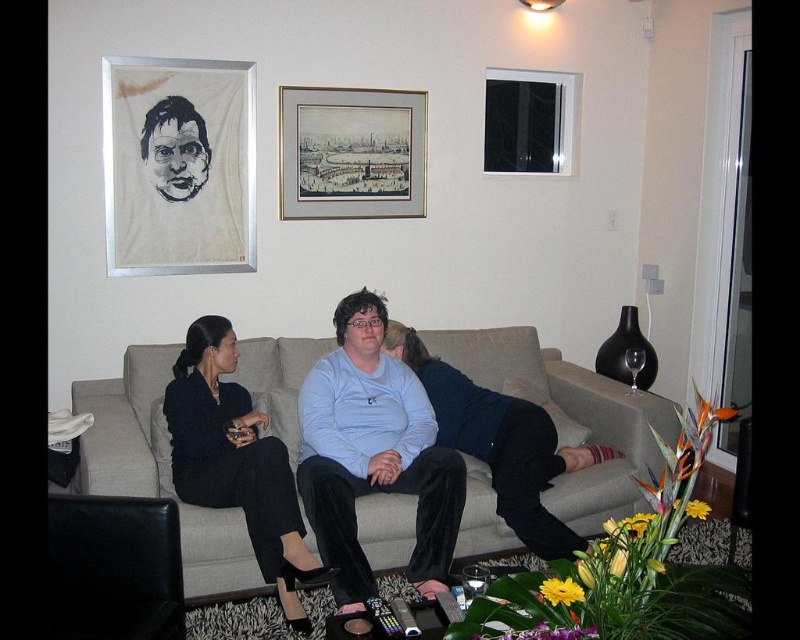
You are standing in the living room and want to take a photo of the light blue cotton shirt at center. If your camera has a minimum focus distance of 7 feet, will you be able to take a clear photo without moving closer?

The light blue cotton shirt at center is 7.26 feet away from the camera. Since the minimum focus distance is 7 feet, the shirt is slightly beyond the camera range, so you might need to move closer to ensure a clear photo.